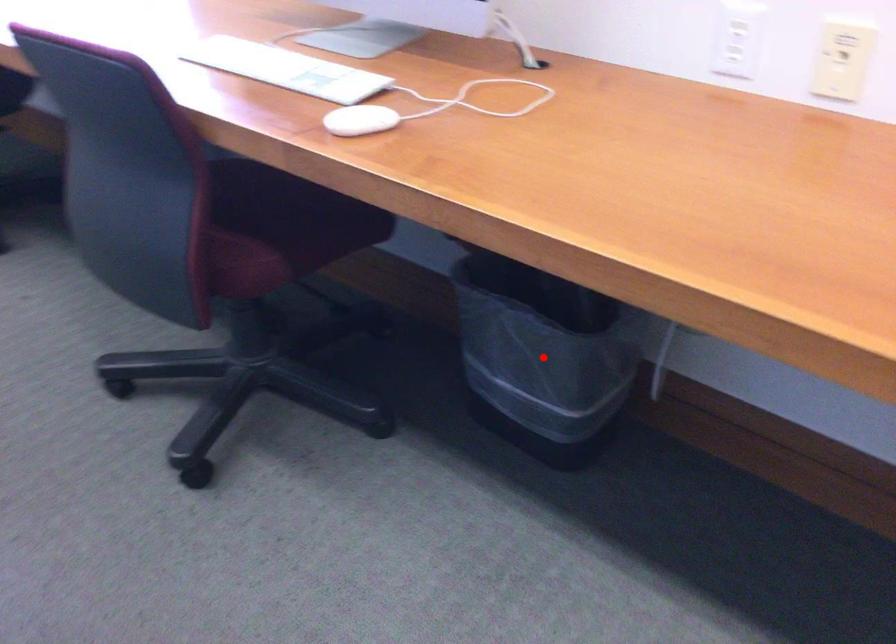
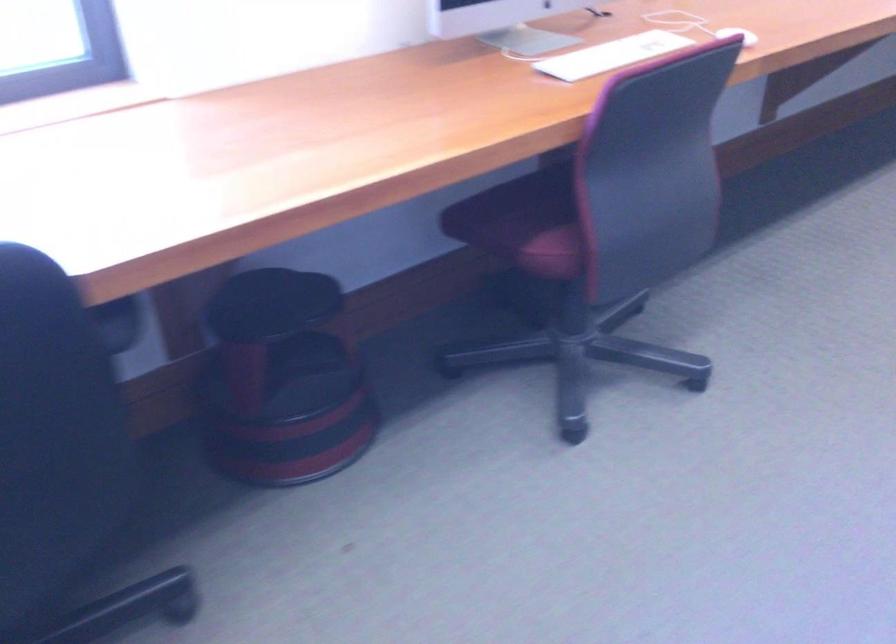
Question: I am providing you with two images of the same scene from different viewpoints. A red point is marked on the first image. At the location where the point appears in image 1, is it still visible in image 2?

Choices:
 (A) Yes
 (B) No

Answer: (B)